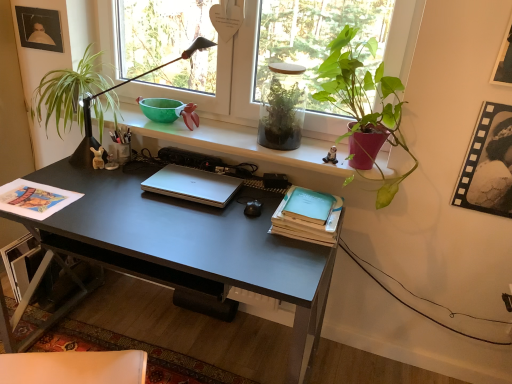
I want to click on free space to the left of silver metallic laptop at center, so click(x=118, y=191).